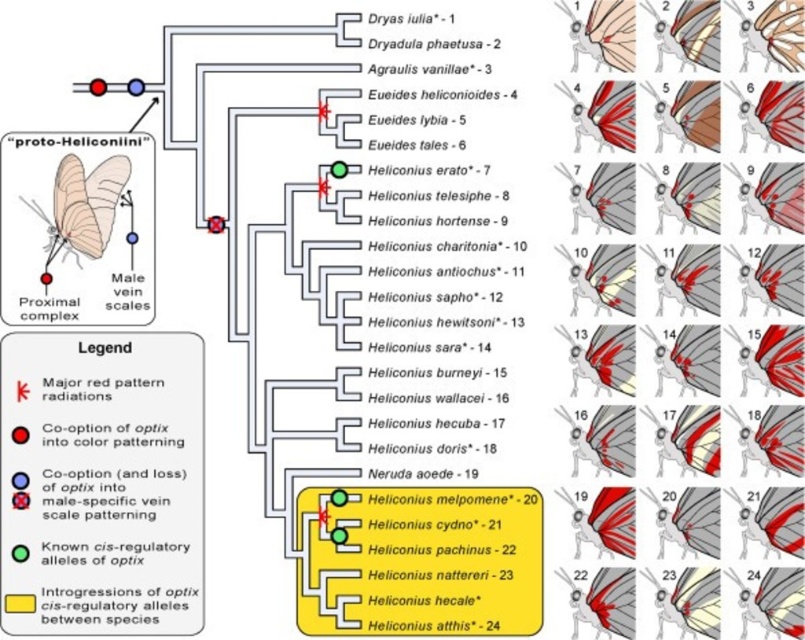
Does point (419, 346) come closer to viewer compared to point (118, 300)?

That is False.

Which is more to the right, dryas iulia* - 1 at upper left or matte black male vein scales at center?

dryas iulia* - 1 at upper left is more to the right.

Describe the element at coordinates (432, 253) in the screenshot. I see `dryas iulia* - 1 at upper left` at that location.

The width and height of the screenshot is (805, 640). What are the coordinates of `dryas iulia* - 1 at upper left` in the screenshot? It's located at (432, 253).

Is point (471, 476) behind point (106, 520)?

That is True.

Can you confirm if dryas iulia* - 1 at upper left is thinner than major red pattern radiations at upper center?

Yes.

Does point (387, 113) come behind point (50, 576)?

Yes.

The width and height of the screenshot is (805, 640). I want to click on dryas iulia* - 1 at upper left, so click(x=432, y=253).

Does point (102, 566) lie behind point (126, 291)?

That is False.

Is point (161, 452) closer to viewer compared to point (131, 296)?

Yes, it is.

Image resolution: width=805 pixels, height=640 pixels. What are the coordinates of `major red pattern radiations at upper center` in the screenshot? It's located at (120, 500).